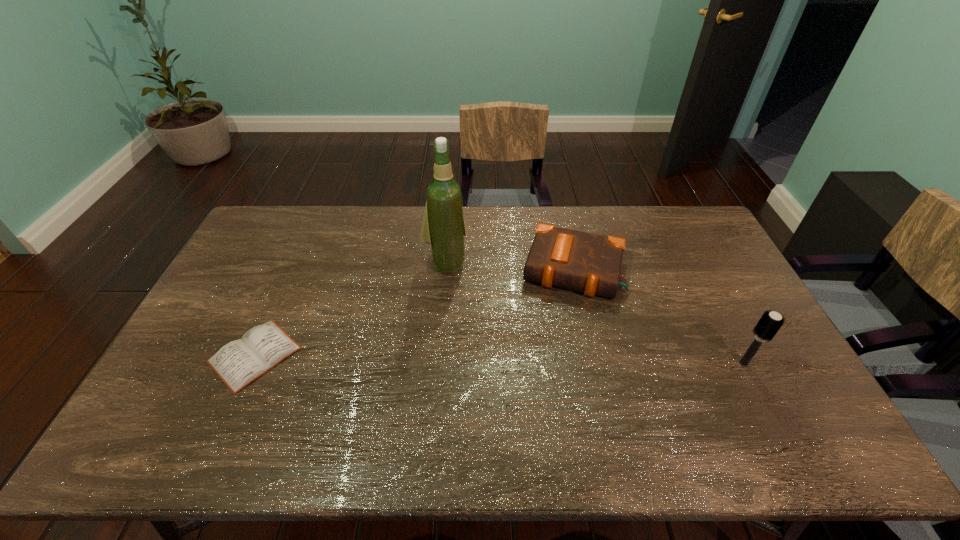
This screenshot has width=960, height=540. I want to click on the leftmost object, so click(x=238, y=363).

The height and width of the screenshot is (540, 960). Identify the location of diary. (238, 363).

Find the location of a particular element. the third shortest object is located at coordinates (769, 324).

Where is `the rightmost object`? The image size is (960, 540). the rightmost object is located at coordinates (769, 324).

Find the location of a particular element. This screenshot has width=960, height=540. the tallest object is located at coordinates (443, 228).

The image size is (960, 540). Identify the location of the third object from right to left. (443, 228).

Where is `the third tallest object`? This screenshot has height=540, width=960. the third tallest object is located at coordinates (579, 261).

You are a GUI agent. You are given a task and a screenshot of the screen. Output one action in this format:
    pyautogui.click(x=<x>, y=<y>)
    Task: Click on the third object from left to right
    
    Given the screenshot: What is the action you would take?
    pyautogui.click(x=579, y=261)

The image size is (960, 540). I want to click on free spot located 0.240m on the right of the shortest object, so pos(386,355).

I want to click on vacant space located 0.110m on the left of the rightmost object, so click(694, 363).